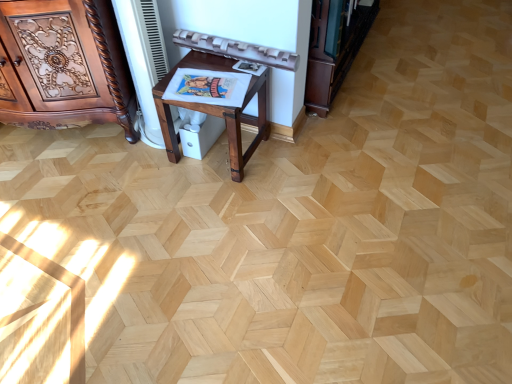
Identify the location of vacant area that lies in front of dark brown wood bookshelf at upper right. The height and width of the screenshot is (384, 512). (352, 127).